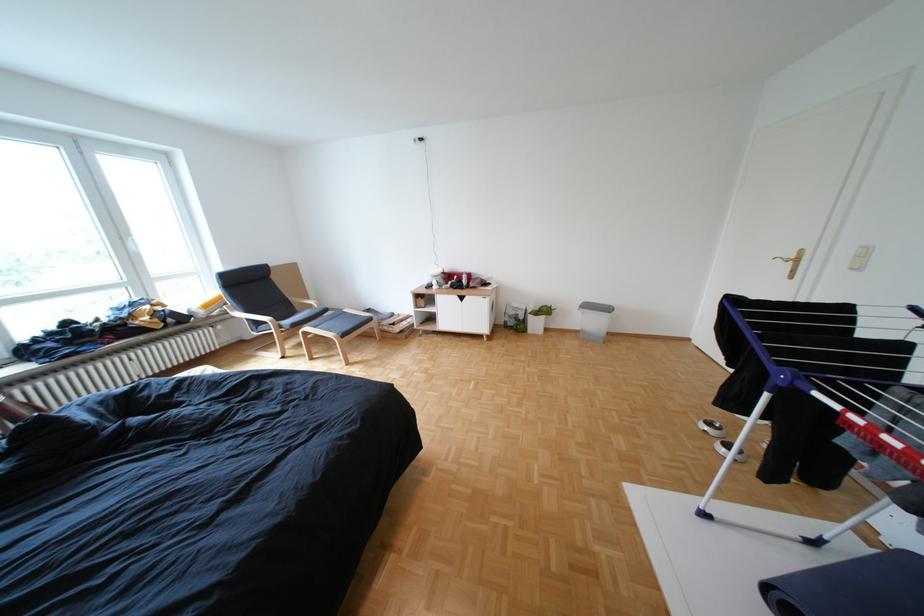
The image size is (924, 616). What do you see at coordinates (128, 241) in the screenshot?
I see `the white window handle` at bounding box center [128, 241].